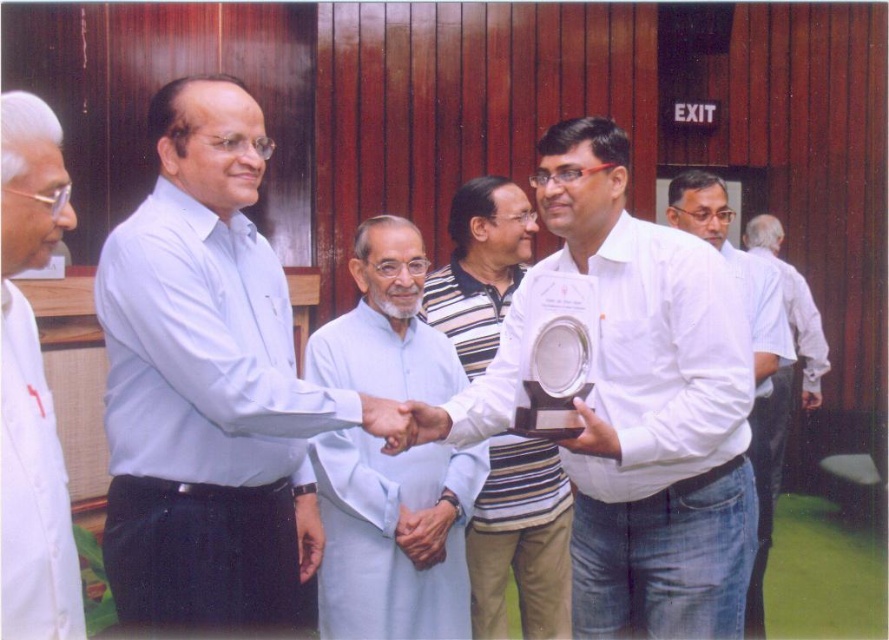
Question: Which object is farther from the camera taking this photo?

Choices:
 (A) white cloth at left
 (B) smooth skin hand at center
 (C) white glossy trophy at center

Answer: (B)

Question: Which point is closer to the camera?

Choices:
 (A) smooth skin hand at center
 (B) white cotton shirt at right
 (C) white shirt at right

Answer: (A)

Question: Is white glossy trophy at center above white shirt at right?

Choices:
 (A) no
 (B) yes

Answer: (A)

Question: Which point is closer to the camera?

Choices:
 (A) light blue fabric at center
 (B) striped cotton shirt at center
 (C) light blue shirt at center
 (D) smooth skin hand at center

Answer: (C)

Question: Can you confirm if white cotton shirt at right is positioned to the left of white shirt at right?

Choices:
 (A) no
 (B) yes

Answer: (B)

Question: Can you confirm if light blue fabric at center is positioned above striped cotton shirt at center?

Choices:
 (A) no
 (B) yes

Answer: (B)